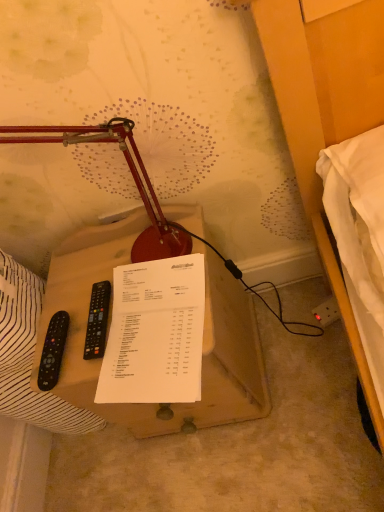
Question: Is black plastic remote at left, the second remote control in the right-to-left sequence, behind black plastic remote control at left, acting as the 2th remote control starting from the left?

Choices:
 (A) no
 (B) yes

Answer: (B)

Question: From the image's perspective, would you say black plastic remote at left, the second remote control in the right-to-left sequence, is positioned over black plastic remote control at left, which is the 1th remote control in right-to-left order?

Choices:
 (A) yes
 (B) no

Answer: (B)

Question: Is the surface of black plastic remote at left, the second remote control in the right-to-left sequence, in direct contact with black plastic remote control at left, which is the 1th remote control in right-to-left order?

Choices:
 (A) no
 (B) yes

Answer: (B)

Question: Is black plastic remote at left, which is the 1th remote control in left-to-right order, thinner than black plastic remote control at left, acting as the 2th remote control starting from the left?

Choices:
 (A) no
 (B) yes

Answer: (B)

Question: Is black plastic remote at left, which is the 1th remote control in left-to-right order, bigger than black plastic remote control at left, acting as the 2th remote control starting from the left?

Choices:
 (A) yes
 (B) no

Answer: (A)

Question: Considering the positions of wooden table at center and black plastic remote at left, the second remote control in the right-to-left sequence, in the image, is wooden table at center taller or shorter than black plastic remote at left, the second remote control in the right-to-left sequence,?

Choices:
 (A) tall
 (B) short

Answer: (A)

Question: Is point (236, 284) closer or farther from the camera than point (61, 352)?

Choices:
 (A) farther
 (B) closer

Answer: (A)

Question: Relative to black plastic remote at left, which is the 1th remote control in left-to-right order, is wooden table at center in front or behind?

Choices:
 (A) behind
 (B) front

Answer: (B)

Question: Would you say wooden table at center is to the left or to the right of black plastic remote at left, the second remote control in the right-to-left sequence, in the picture?

Choices:
 (A) right
 (B) left

Answer: (A)

Question: In terms of size, does white paper at center appear bigger or smaller than matte red lamp at center?

Choices:
 (A) small
 (B) big

Answer: (A)

Question: In the image, is white paper at center positioned in front of or behind matte red lamp at center?

Choices:
 (A) front
 (B) behind

Answer: (B)

Question: From a real-world perspective, is white paper at center physically located above or below matte red lamp at center?

Choices:
 (A) below
 (B) above

Answer: (A)

Question: Visually, is white paper at center positioned to the left or to the right of matte red lamp at center?

Choices:
 (A) left
 (B) right

Answer: (B)

Question: Choose the correct answer: Is white paper at left inside matte red lamp at center or outside it?

Choices:
 (A) inside
 (B) outside

Answer: (B)

Question: In the image, is white paper at left positioned in front of or behind matte red lamp at center?

Choices:
 (A) behind
 (B) front

Answer: (A)